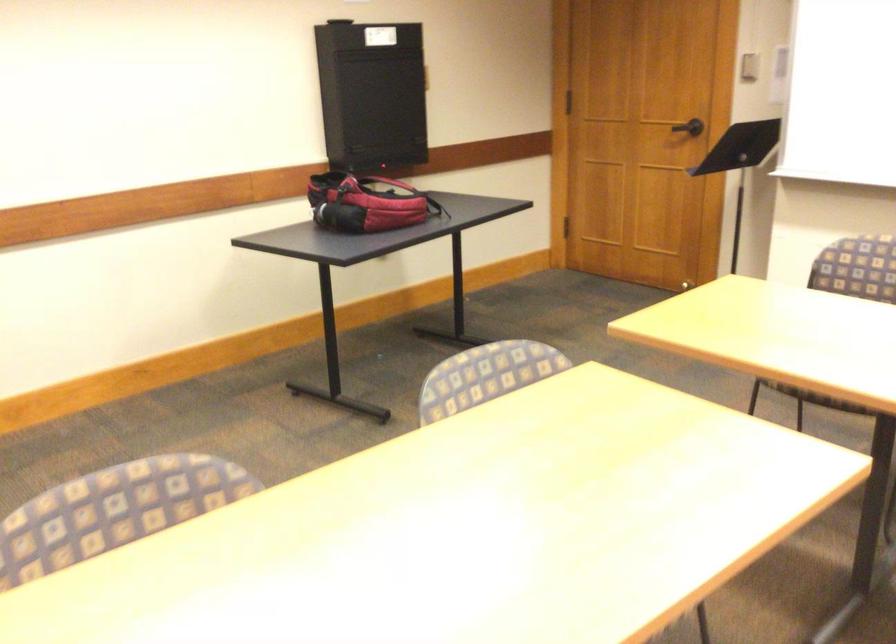
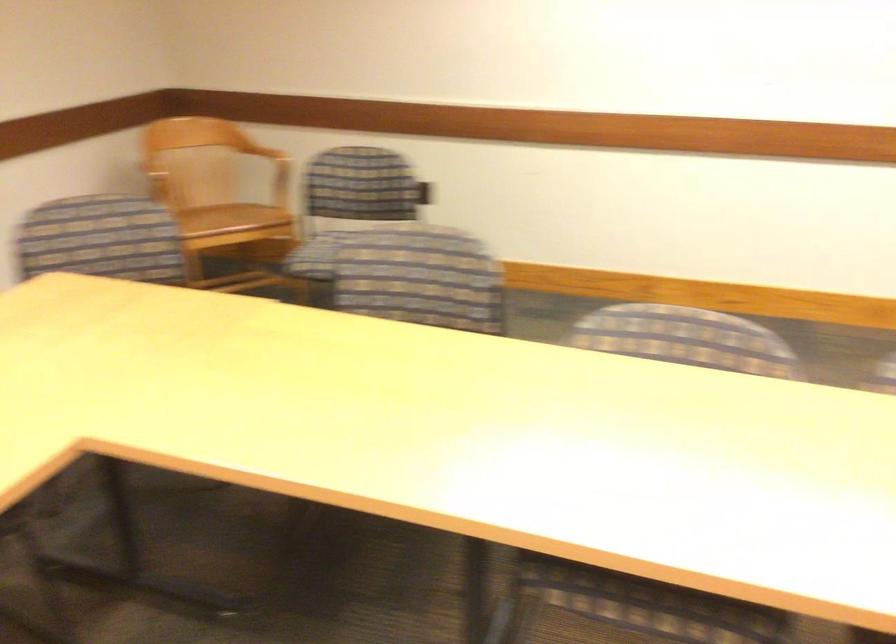
Question: How did the camera likely rotate?

Choices:
 (A) Left
 (B) Right
 (C) Up
 (D) Down

Answer: (A)